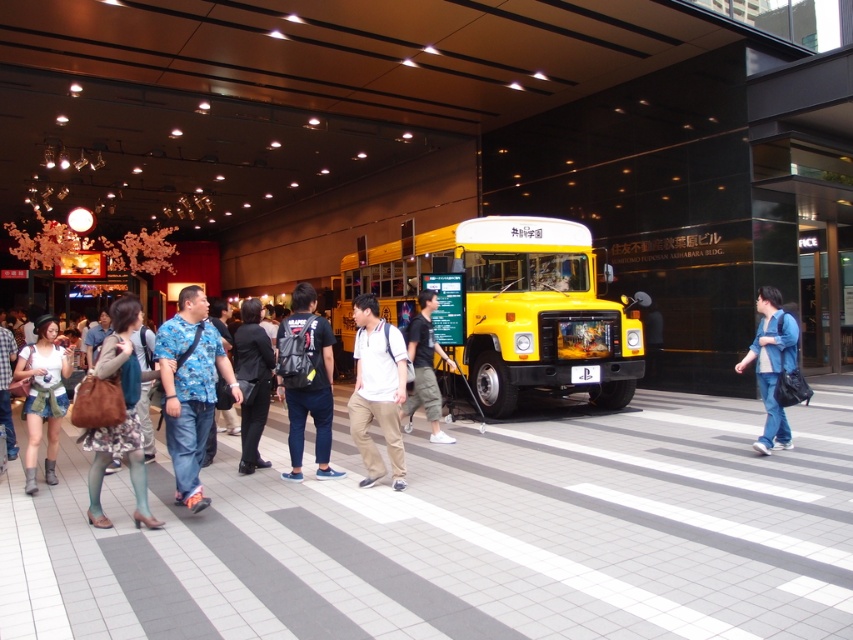
Can you confirm if black matte backpack at center is wider than dark gray fabric pants at center?

In fact, black matte backpack at center might be narrower than dark gray fabric pants at center.

Does black matte backpack at center appear on the left side of dark gray fabric pants at center?

Correct, you'll find black matte backpack at center to the left of dark gray fabric pants at center.

Where is `black matte backpack at center`? This screenshot has height=640, width=853. black matte backpack at center is located at coordinates (306, 380).

Does denim shorts at center have a greater width compared to black fabric pants at center?

Yes.

This screenshot has width=853, height=640. Identify the location of denim shorts at center. point(44,396).

Can you confirm if black matte backpack at center is bigger than matte brown purse at center?

Correct, black matte backpack at center is larger in size than matte brown purse at center.

Image resolution: width=853 pixels, height=640 pixels. Find the location of `black matte backpack at center`. black matte backpack at center is located at coordinates (306, 380).

Who is more distant from viewer, [329,429] or [120,337]?

Positioned behind is point [329,429].

You are a GUI agent. You are given a task and a screenshot of the screen. Output one action in this format:
    pyautogui.click(x=<x>, y=<y>)
    Task: Click on the black matte backpack at center
    
    Given the screenshot: What is the action you would take?
    pyautogui.click(x=306, y=380)